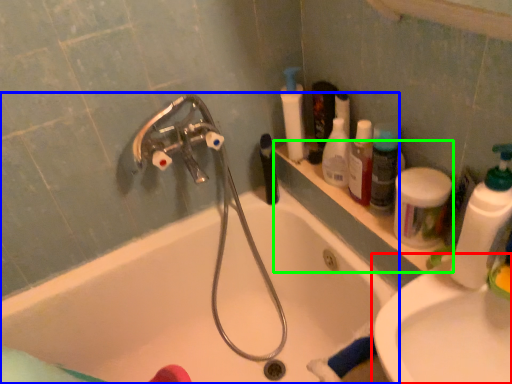
Question: Which object is the farthest from sink (highlighted by a red box)? Choose among these: bathtub (highlighted by a blue box) or ledge (highlighted by a green box).

Choices:
 (A) bathtub
 (B) ledge

Answer: (A)